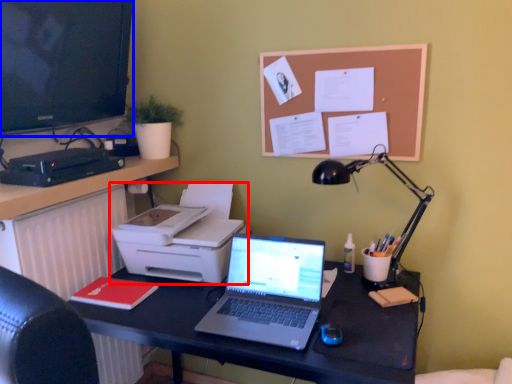
Question: Which object appears farthest to the camera in this image, printer (highlighted by a red box) or television (highlighted by a blue box)?

Choices:
 (A) printer
 (B) television

Answer: (A)